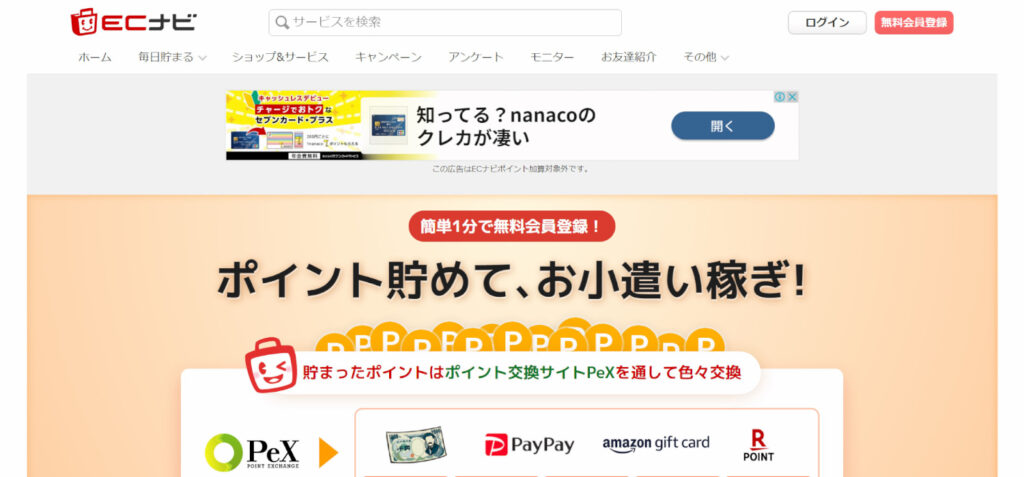
This screenshot has height=477, width=1024. In order to click on television icon in this screenshot , I will do click(271, 370).